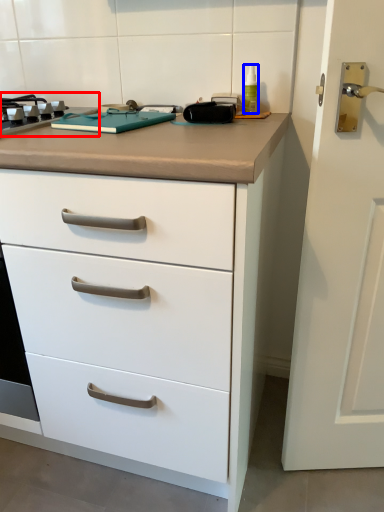
Question: Among these objects, which one is nearest to the camera, gas stove (highlighted by a red box) or bottle (highlighted by a blue box)?

Choices:
 (A) gas stove
 (B) bottle

Answer: (A)